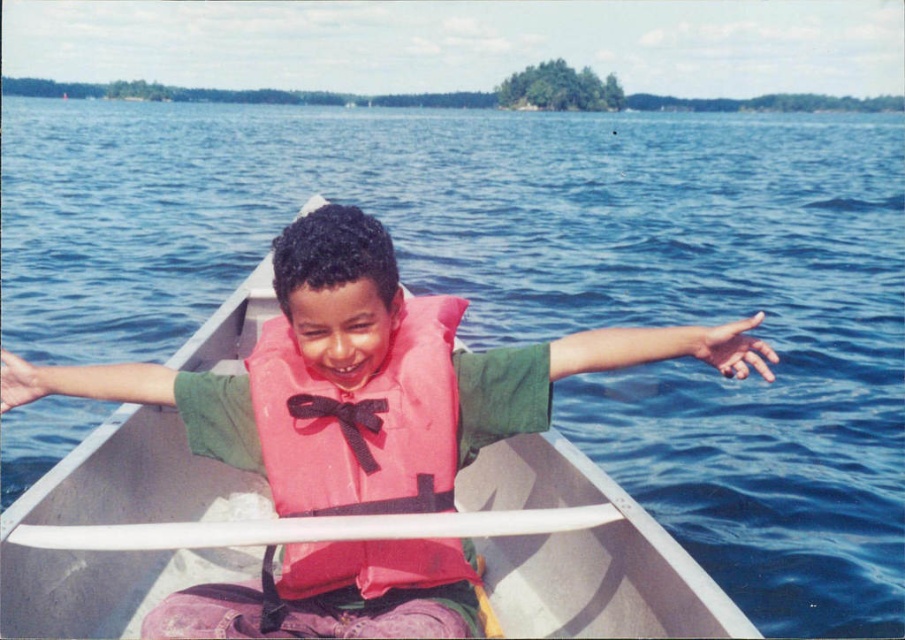
Can you confirm if pink fabric life vest at center is smaller than black satin bow tie at center?

Incorrect, pink fabric life vest at center is not smaller in size than black satin bow tie at center.

Who is shorter, pink fabric life vest at center or black satin bow tie at center?

With less height is black satin bow tie at center.

This screenshot has width=905, height=640. In order to click on pink fabric life vest at center in this screenshot , I will do `click(329, 390)`.

Image resolution: width=905 pixels, height=640 pixels. Identify the location of pink fabric life vest at center. (329, 390).

The image size is (905, 640). Identify the location of pink fabric life jacket at center. coord(362,420).

Describe the element at coordinates (362, 420) in the screenshot. The width and height of the screenshot is (905, 640). I see `pink fabric life jacket at center` at that location.

Who is more distant from viewer, (293, 349) or (164, 534)?

Point (293, 349)

The height and width of the screenshot is (640, 905). In order to click on pink fabric life jacket at center in this screenshot , I will do `click(362, 420)`.

Who is shorter, pink fabric life vest at center or white plastic paddle at center?

white plastic paddle at center

Between point (418, 371) and point (443, 531), which one is positioned in front?

Point (443, 531) is in front.

Find the location of `pink fabric life vest at center`. pink fabric life vest at center is located at coordinates (329, 390).